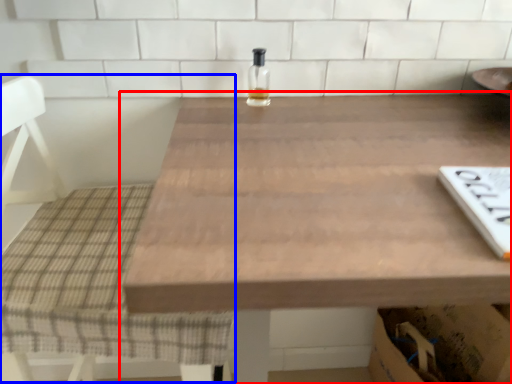
Question: Which object is closer to the camera taking this photo, table (highlighted by a red box) or chair (highlighted by a blue box)?

Choices:
 (A) table
 (B) chair

Answer: (A)